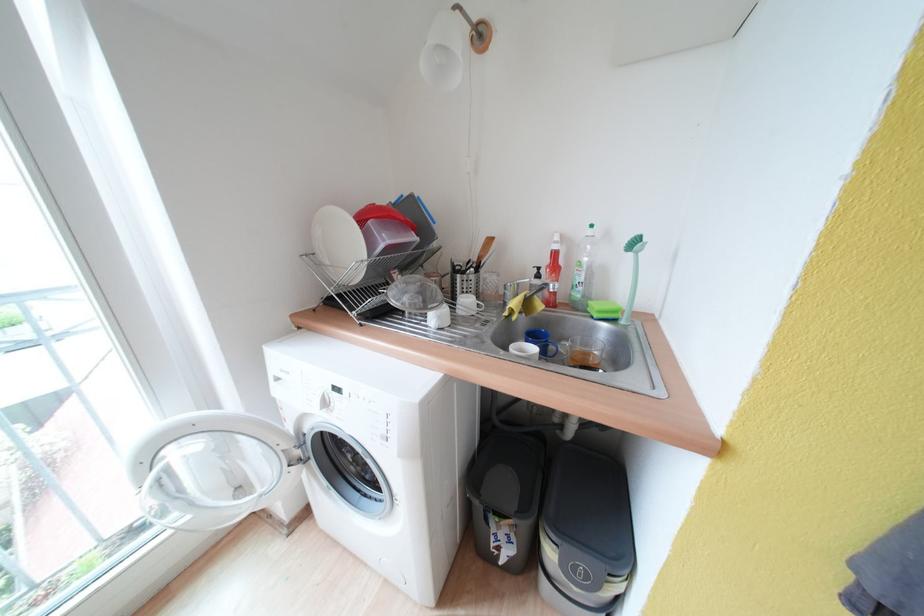
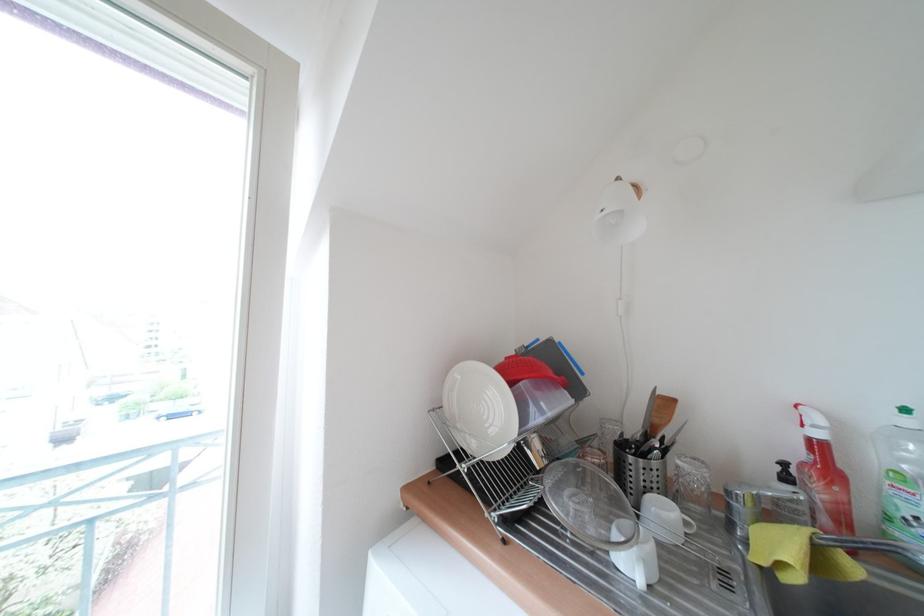
Based on the photo, the images are taken continuously from a first-person perspective. In which direction are you moving?

The cameraman walked toward left, forward.